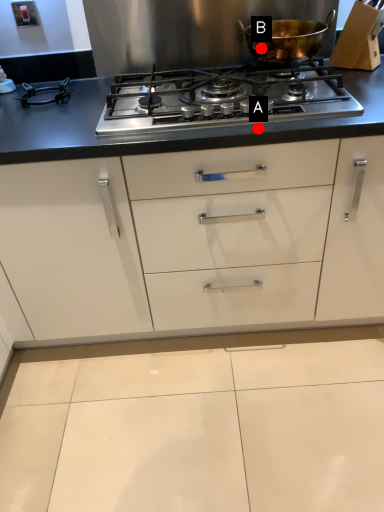
Question: Two points are circled on the image, labeled by A and B beside each circle. Among these points, which one is farthest from the camera?

Choices:
 (A) A is further
 (B) B is further

Answer: (B)